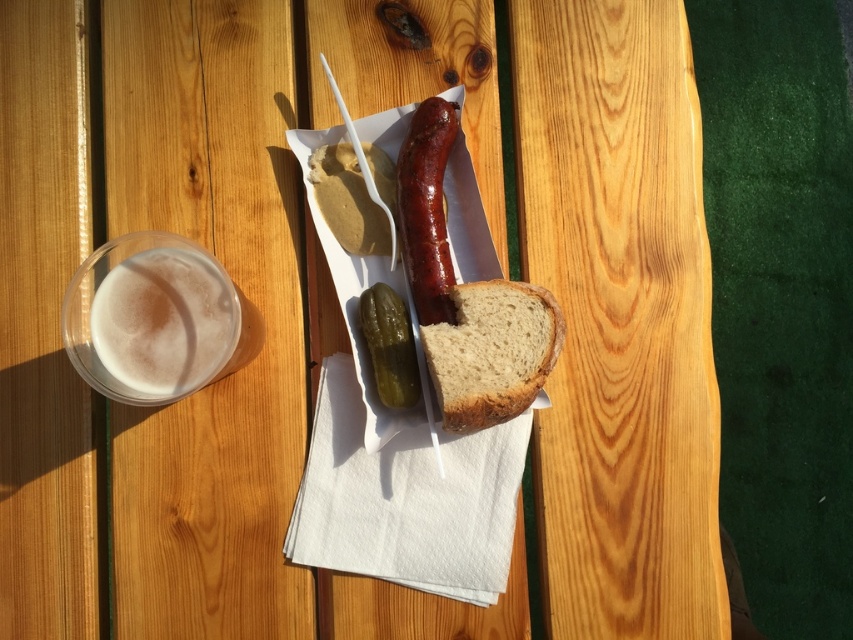
Question: Where is foamy plastic cup at left located in relation to green pickled vegetable at center in the image?

Choices:
 (A) above
 (B) below

Answer: (A)

Question: Is shiny brown sausage at center closer to the viewer compared to matte yellow mustard at center?

Choices:
 (A) yes
 (B) no

Answer: (A)

Question: Among these objects, which one is farthest from the camera?

Choices:
 (A) matte yellow mustard at center
 (B) brown crusty bread at center
 (C) shiny brown sausage at center
 (D) foamy plastic cup at left

Answer: (A)

Question: Which point is farther from the camera taking this photo?

Choices:
 (A) (389, 321)
 (B) (341, 170)

Answer: (B)

Question: Which of the following is the closest to the observer?

Choices:
 (A) (415, 140)
 (B) (532, 317)

Answer: (B)

Question: Does foamy plastic cup at left appear over green pickled vegetable at center?

Choices:
 (A) no
 (B) yes

Answer: (B)